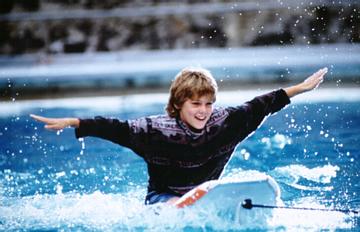
Find the location of `board`. board is located at coordinates (224, 192).